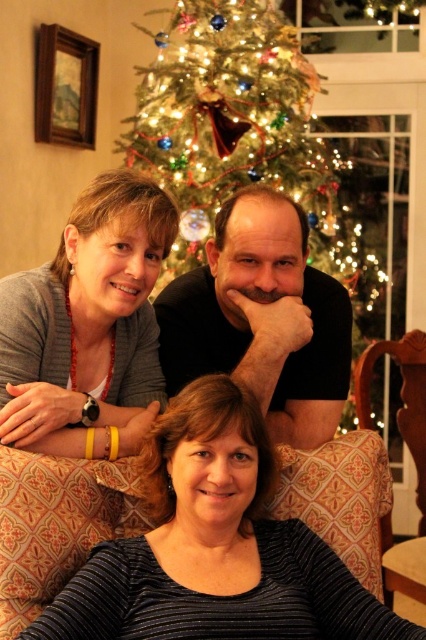
Between black ribbed sweater at lower center and iridescent glass ornaments at center, which one appears on the left side from the viewer's perspective?

black ribbed sweater at lower center is more to the left.

Does point (362, 502) come closer to viewer compared to point (241, 176)?

Yes, it is.

You are a GUI agent. You are given a task and a screenshot of the screen. Output one action in this format:
    pyautogui.click(x=<x>, y=<y>)
    Task: Click on the black ribbed sweater at lower center
    Image resolution: width=426 pixels, height=640 pixels.
    Given the screenshot: What is the action you would take?
    pyautogui.click(x=187, y=582)

Consider the image. Can you confirm if black ribbed sweater at lower center is wider than black matte shirt at center?

Yes.

Describe the element at coordinates (187, 582) in the screenshot. Image resolution: width=426 pixels, height=640 pixels. I see `black ribbed sweater at lower center` at that location.

Between point (290, 557) and point (273, 433), which one is positioned in front?

Positioned in front is point (290, 557).

Locate an element on the screen. The image size is (426, 640). black ribbed sweater at lower center is located at coordinates (187, 582).

Can you confirm if matte gray sweater at center is taller than black matte shirt at center?

Yes, matte gray sweater at center is taller than black matte shirt at center.

Between matte gray sweater at center and black matte shirt at center, which one appears on the right side from the viewer's perspective?

From the viewer's perspective, black matte shirt at center appears more on the right side.

Is point (62, 248) closer to viewer compared to point (310, 278)?

Yes.

Find the location of a particular element. This screenshot has height=640, width=426. matte gray sweater at center is located at coordinates (86, 323).